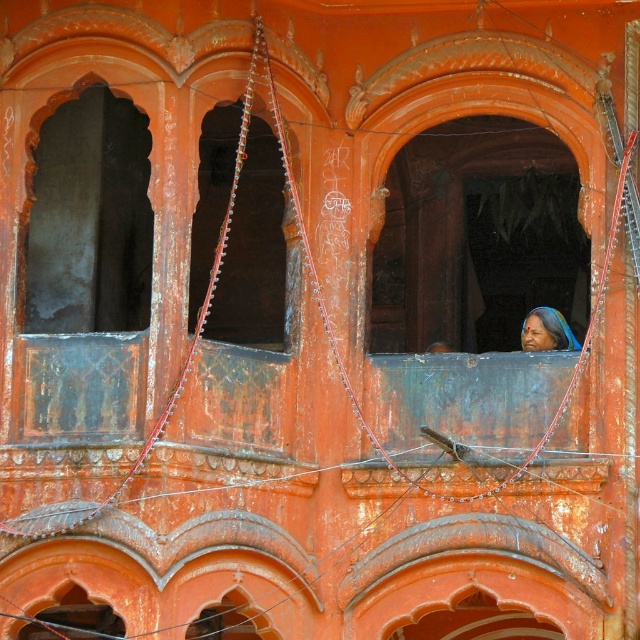
Question: Estimate the real-world distances between objects in this image. Which object is farther from the dark brown wooden window at center?

Choices:
 (A) dark gray stone arch at left
 (B) matte blue sari at center

Answer: (B)

Question: Does dark gray stone arch at left have a greater width compared to matte blue sari at center?

Choices:
 (A) yes
 (B) no

Answer: (A)

Question: Where is dark gray stone arch at left located in relation to matte blue sari at center in the image?

Choices:
 (A) below
 (B) above

Answer: (B)

Question: Which object is the farthest from the dark gray stone arch at left?

Choices:
 (A) matte blue sari at center
 (B) dark brown wooden window at center

Answer: (A)

Question: Which is farther from the dark gray stone arch at left?

Choices:
 (A) matte blue sari at center
 (B) dark brown wooden window at center

Answer: (A)

Question: In this image, where is dark gray stone arch at left located relative to matte blue sari at center?

Choices:
 (A) above
 (B) below

Answer: (A)